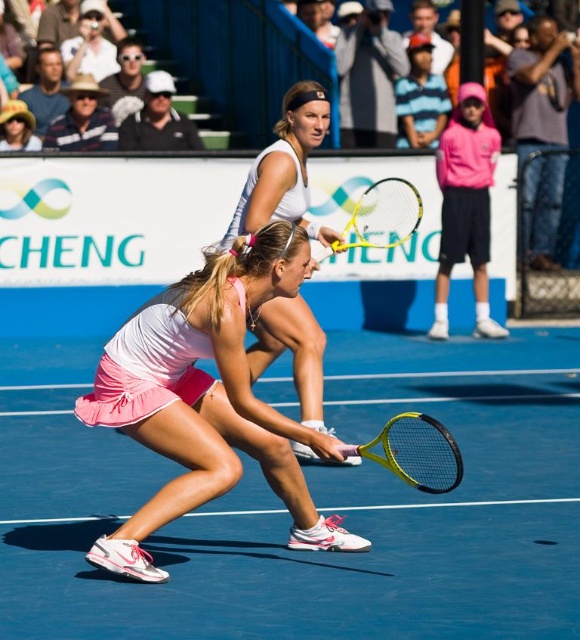
Between pink fabric tennis skirt at lower center and pink matte tennis outfit at center, which one is positioned higher?

pink matte tennis outfit at center is higher up.

Does pink fabric tennis skirt at lower center appear under pink matte tennis outfit at center?

Yes.

Does point (288, 243) come in front of point (466, 88)?

That is True.

At what (x,y) coordinates should I click in order to perform the action: click on pink fabric tennis skirt at lower center. Please return your answer as a coordinate pair (x, y). This screenshot has width=580, height=640. Looking at the image, I should click on (206, 397).

Who is taller, pink matte tennis outfit at center or yellow matte tennis racket at center?

pink matte tennis outfit at center

Does pink matte tennis outfit at center have a greater width compared to yellow matte tennis racket at center?

Indeed, pink matte tennis outfit at center has a greater width compared to yellow matte tennis racket at center.

This screenshot has height=640, width=580. Describe the element at coordinates (466, 205) in the screenshot. I see `pink matte tennis outfit at center` at that location.

Where is `pink matte tennis outfit at center`? This screenshot has height=640, width=580. pink matte tennis outfit at center is located at coordinates (466, 205).

Between pink fabric tennis skirt at center and yellow frame tennis racket at center, which one has less height?

With less height is yellow frame tennis racket at center.

Does pink fabric tennis skirt at center appear over yellow frame tennis racket at center?

Yes, pink fabric tennis skirt at center is above yellow frame tennis racket at center.

Is point (274, 304) farther from camera compared to point (382, 180)?

That is False.

Locate an element on the screen. The image size is (580, 640). pink fabric tennis skirt at center is located at coordinates (284, 168).